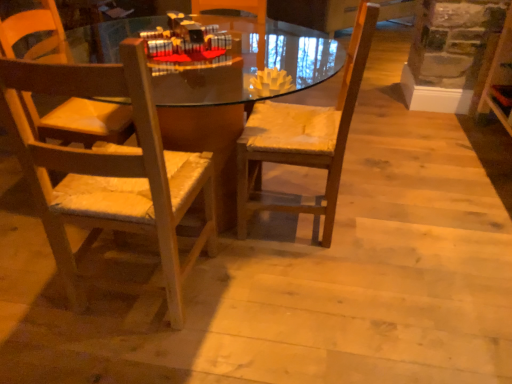
Find the location of `free space in front of wooden chair at center, which is the 2th chair from left to right`. free space in front of wooden chair at center, which is the 2th chair from left to right is located at coordinates (300, 273).